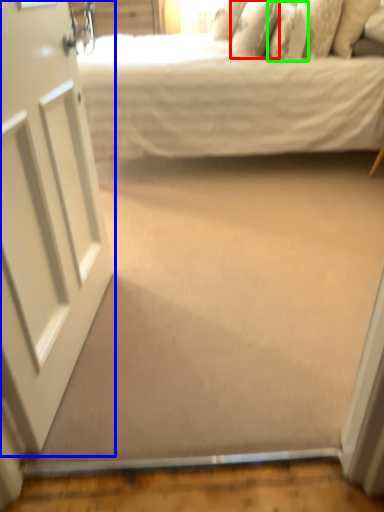
Question: Estimate the real-world distances between objects in this image. Which object is farther from pillow (highlighted by a red box), door (highlighted by a blue box) or pillow (highlighted by a green box)?

Choices:
 (A) door
 (B) pillow

Answer: (A)